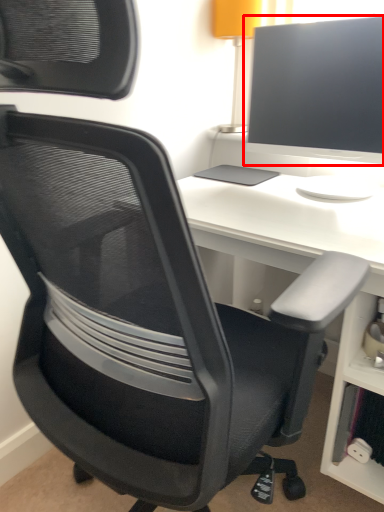
Question: Observing the image, what is the correct spatial positioning of computer monitor (annotated by the red box) in reference to desk?

Choices:
 (A) right
 (B) left

Answer: (A)